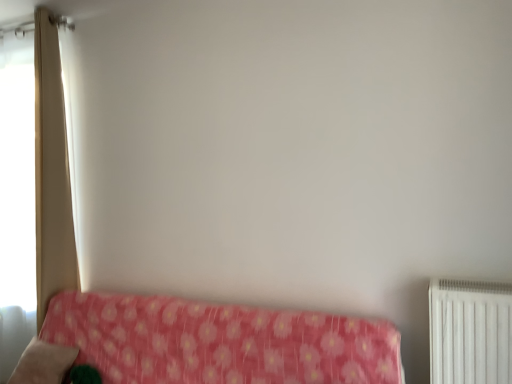
Question: Is beige fabric curtain at left taller or shorter than pink floral fabric at lower left?

Choices:
 (A) tall
 (B) short

Answer: (A)

Question: Considering the positions of point (53, 145) and point (222, 349), is point (53, 145) closer or farther from the camera than point (222, 349)?

Choices:
 (A) farther
 (B) closer

Answer: (A)

Question: Which of these objects is positioned farthest from the beige fabric curtain at left?

Choices:
 (A) soft pink fabric pillow at lower left
 (B) pink floral fabric at lower left

Answer: (B)

Question: Considering the real-world distances, which object is closest to the beige fabric curtain at left?

Choices:
 (A) soft pink fabric pillow at lower left
 (B) pink floral fabric at lower left

Answer: (A)